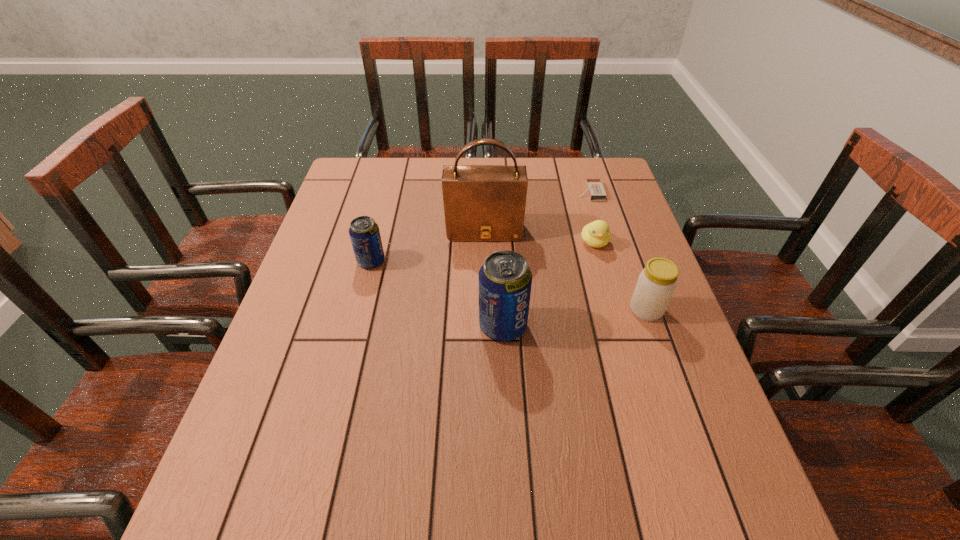
The image size is (960, 540). In order to click on duckling located at the right edge in this screenshot , I will do `click(596, 234)`.

Locate an element on the screen. This screenshot has height=540, width=960. jar positioned at the right edge is located at coordinates (656, 284).

Locate an element on the screen. The height and width of the screenshot is (540, 960). object that is at the far right corner is located at coordinates (595, 188).

You are a GUI agent. You are given a task and a screenshot of the screen. Output one action in this format:
    pyautogui.click(x=<x>, y=<y>)
    Task: Click on the free space at the far edge of the desktop
    Image resolution: width=960 pixels, height=540 pixels.
    Given the screenshot: What is the action you would take?
    pyautogui.click(x=551, y=178)

This screenshot has width=960, height=540. I want to click on free space at the near edge of the desktop, so click(x=323, y=454).

In order to click on vacant space at the left edge of the desktop in this screenshot , I will do `click(328, 295)`.

In the image, there is a desktop. Identify the location of vacant space at the right edge. This screenshot has height=540, width=960. (627, 364).

What are the coordinates of `vacant area at the far left corner` in the screenshot? It's located at (354, 180).

Identify the location of vacant space at the near left corner of the desktop. The height and width of the screenshot is (540, 960). (270, 423).

Locate an element on the screen. The image size is (960, 540). vacant space at the far right corner of the desktop is located at coordinates (604, 174).